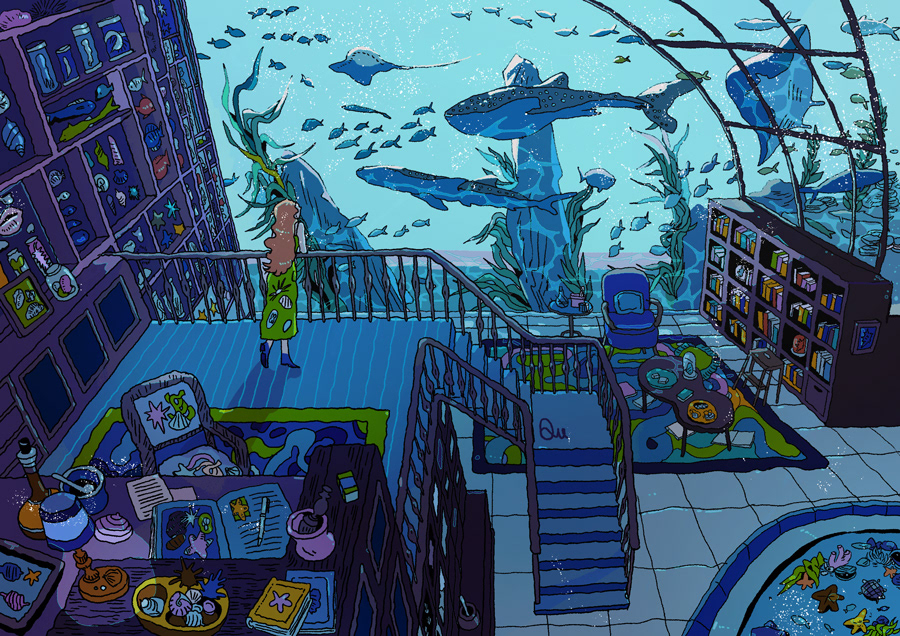
Image resolution: width=900 pixels, height=636 pixels. Identify the location of seccond set of stairs. (477, 359).